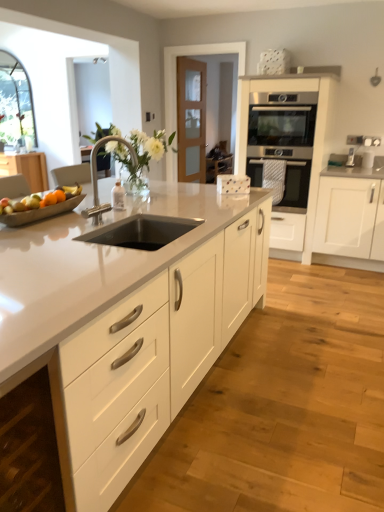
Question: Considering the positions of black stainless steel sink at center and white matte cabinet at lower left, the third cabinetry when ordered from back to front, in the image, is black stainless steel sink at center bigger or smaller than white matte cabinet at lower left, the third cabinetry when ordered from back to front,?

Choices:
 (A) small
 (B) big

Answer: (A)

Question: In terms of width, does black stainless steel sink at center look wider or thinner when compared to white matte cabinet at lower left, the first cabinetry positioned from the left?

Choices:
 (A) wide
 (B) thin

Answer: (A)

Question: Which object is the farthest from the shiny metallic bowl at left?

Choices:
 (A) black stainless steel sink at center
 (B) white matte cabinet at lower left, which is the 3th cabinetry in right-to-left order
 (C) white glossy countertop at center
 (D) stainless steel oven at center
 (E) white matte vase at center

Answer: (D)

Question: Estimate the real-world distances between objects in this image. Which object is closer to the white matte cabinet at lower left, which is the 3th cabinetry in right-to-left order?

Choices:
 (A) stainless steel oven at center
 (B) white glossy countertop at center
 (C) black stainless steel sink at center
 (D) white matte cabinet at right, marked as the 1th cabinetry in a right-to-left arrangement
 (E) shiny metallic bowl at left

Answer: (B)